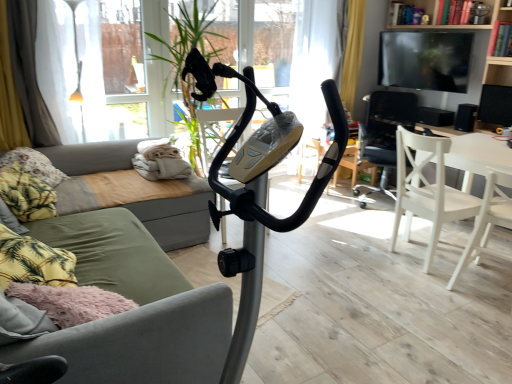
At what (x,y) coordinates should I click in order to perform the action: click on vacant space positioned to the left of white wood chair at right, acting as the 3th chair starting from the back. Please return your answer as a coordinate pair (x, y). Looking at the image, I should click on (430, 288).